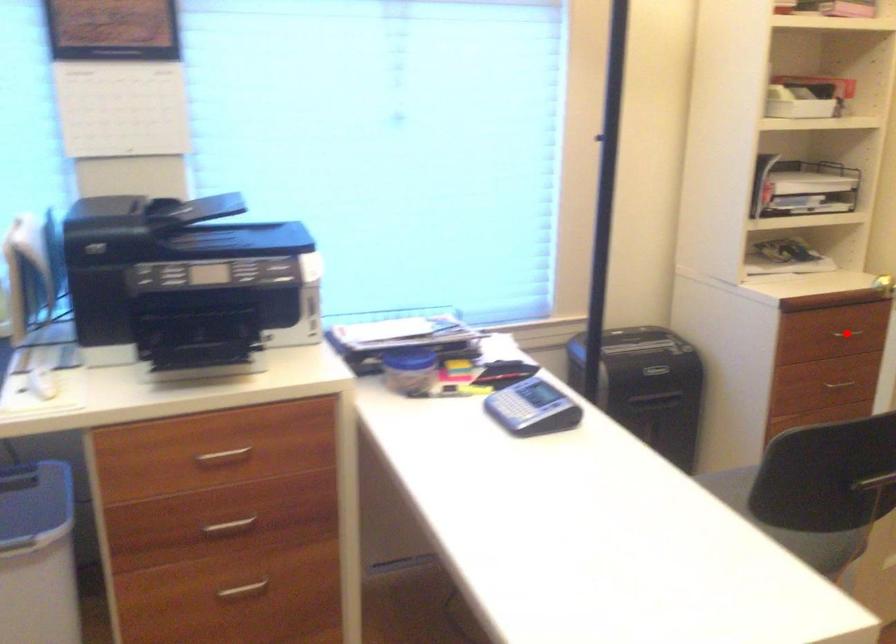
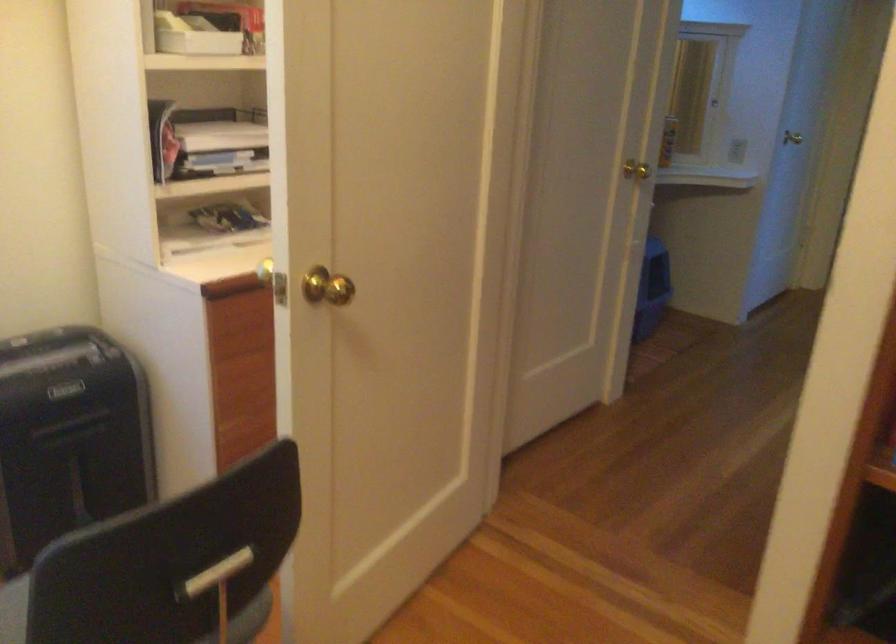
Question: I am providing you with two images of the same scene from different viewpoints. A red point is marked on the first image. Can you still see the location of the red point in image 2?

Choices:
 (A) Yes
 (B) No

Answer: (B)